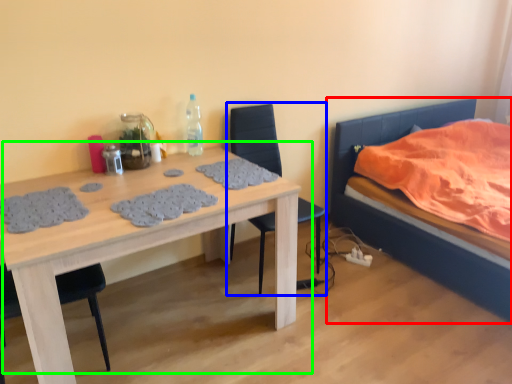
Question: Based on their relative distances, which object is nearer to bed (highlighted by a red box)? Choose from chair (highlighted by a blue box) and table (highlighted by a green box).

Choices:
 (A) chair
 (B) table

Answer: (A)